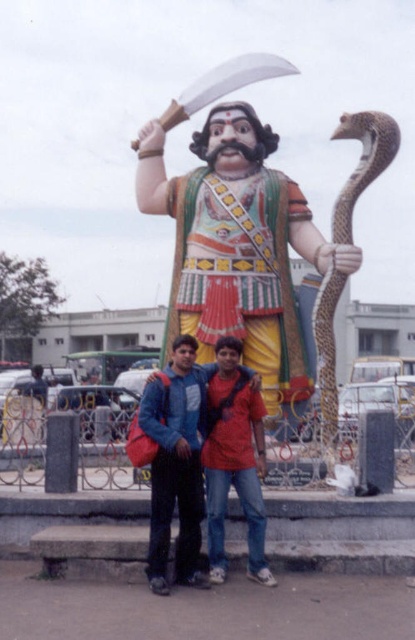
The width and height of the screenshot is (415, 640). Describe the element at coordinates (237, 246) in the screenshot. I see `polished bronze statue at center` at that location.

This screenshot has width=415, height=640. Describe the element at coordinates (237, 246) in the screenshot. I see `polished bronze statue at center` at that location.

Locate an element on the screen. The image size is (415, 640). polished bronze statue at center is located at coordinates (237, 246).

Is polished bronze statue at center in front of denim jacket at center?

No, polished bronze statue at center is further to the viewer.

Is point (212, 305) in front of point (209, 378)?

No, it is not.

The width and height of the screenshot is (415, 640). Find the location of `polished bronze statue at center`. polished bronze statue at center is located at coordinates (237, 246).

Is point (227, 372) positioned after point (358, 124)?

No.

Between point (156, 467) and point (341, 129), which one is positioned behind?

The point (341, 129) is more distant.

The height and width of the screenshot is (640, 415). Identify the location of denim jacket at center. (192, 472).